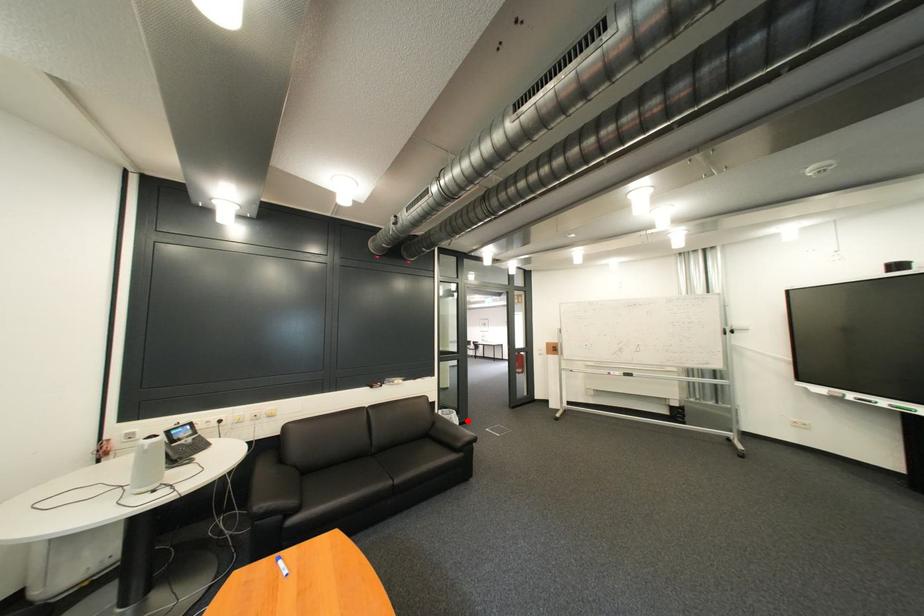
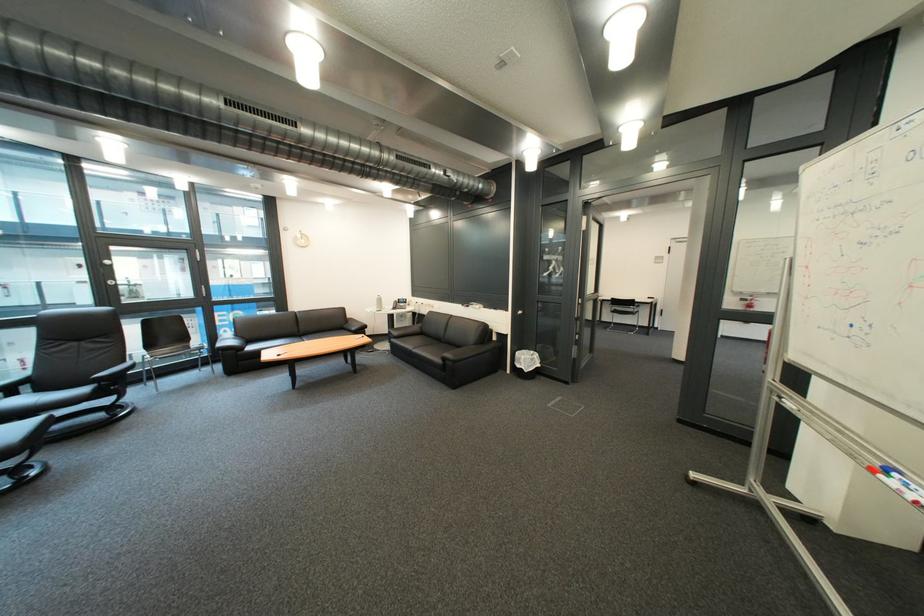
Question: A red point is marked in image1. In image2, is the corresponding 3D point closer to the camera or farther? Reply with the corresponding letter.

Choices:
 (A) The corresponding 3D point is closer.
 (B) The corresponding 3D point is farther.

Answer: (A)